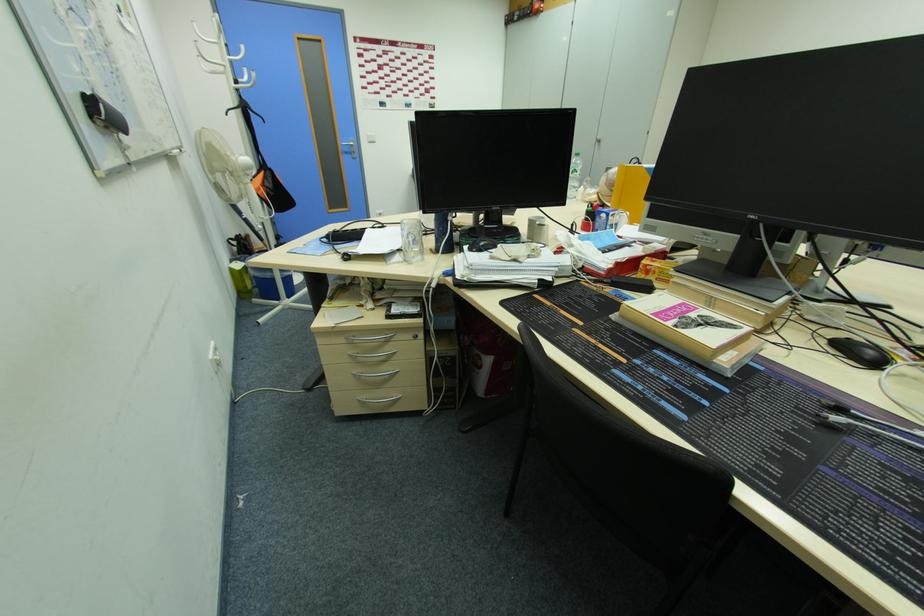
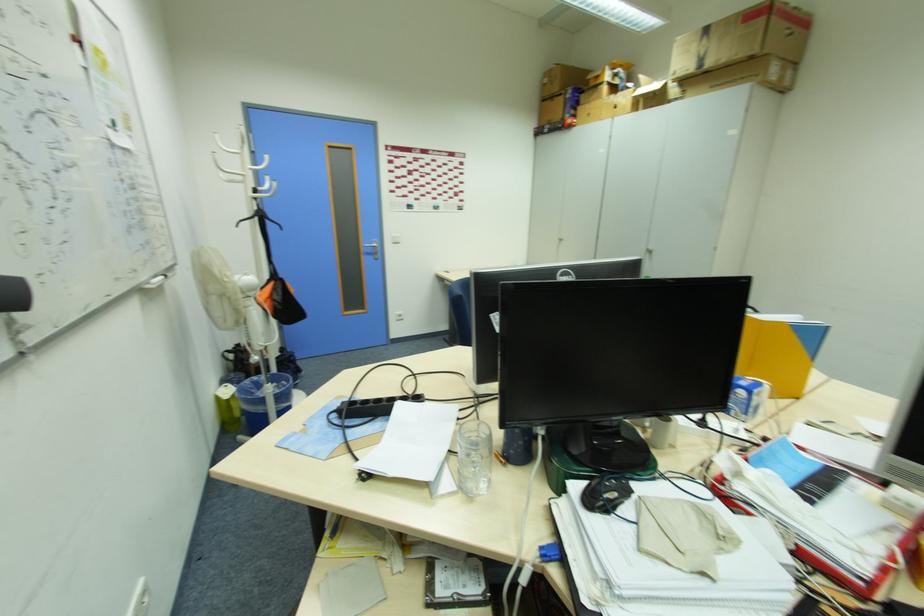
Find the pixel in the second image that matches point (275, 195) in the first image.

(283, 309)